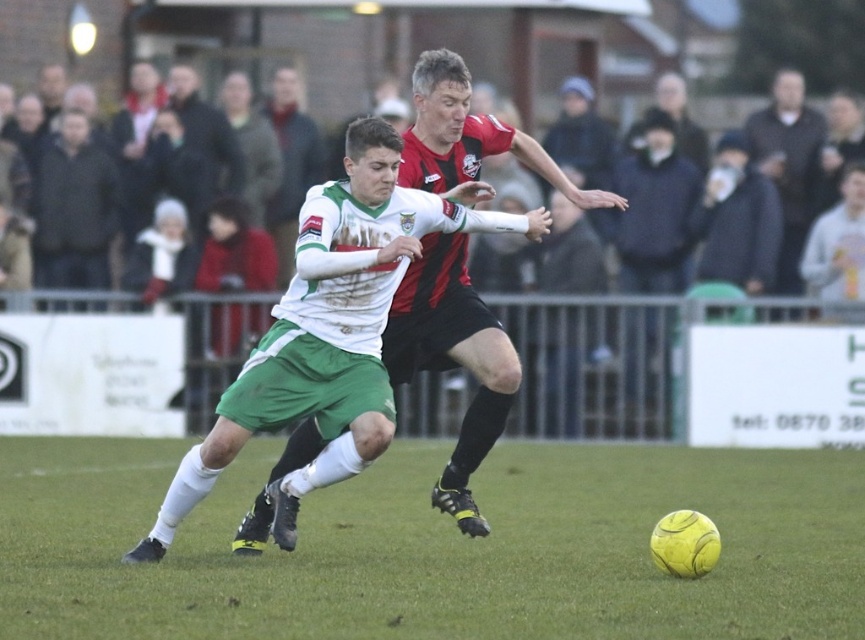
Based on the coordinates provided in the scene, where exactly is the yellow rubber ball at center located?

The yellow rubber ball at center is located at point 0.853 on the x axis and 0.504 on the y axis.

You are a soccer coach analyzing the game from the sidelines. You notice the white jersey at center and the dark gray jacket at upper left. Which player is positioned closer to the ball?

The white jersey at center is located below dark gray jacket at upper left, so the white jersey at center is closer to the ball since it is positioned lower in the image.